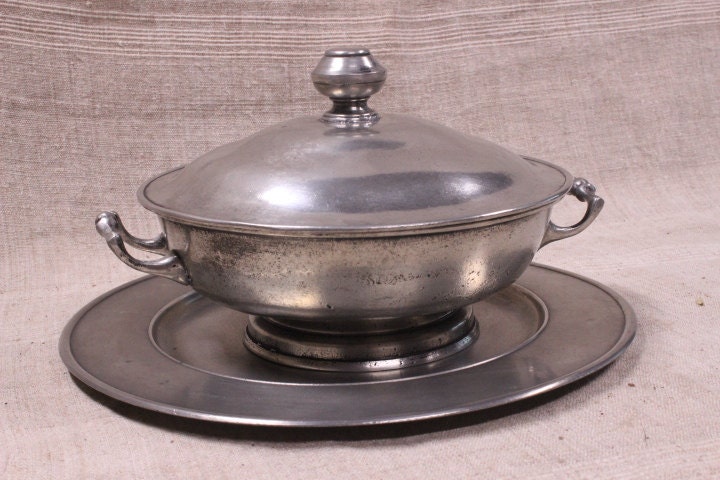
Locate an element on the screen. Image resolution: width=720 pixels, height=480 pixels. cover is located at coordinates tap(390, 183).